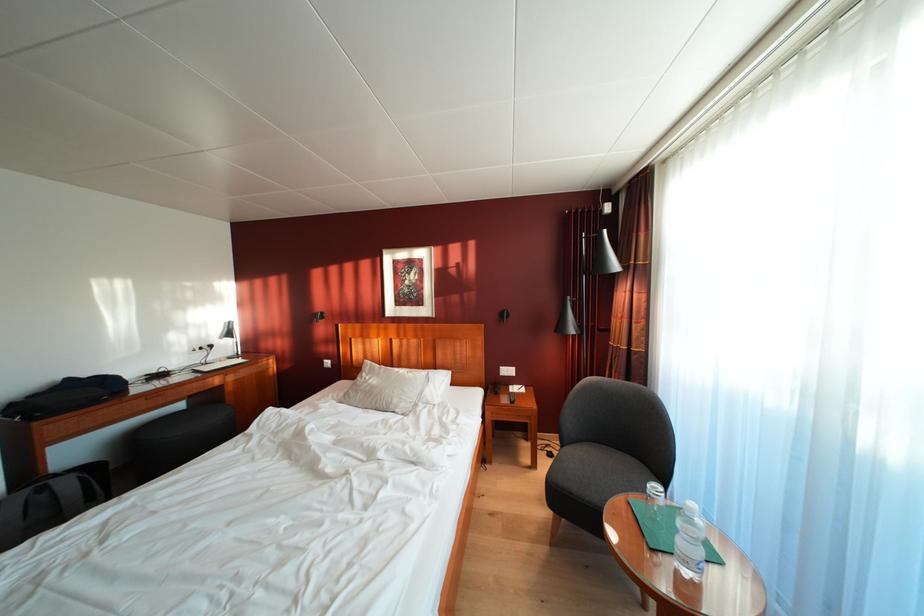
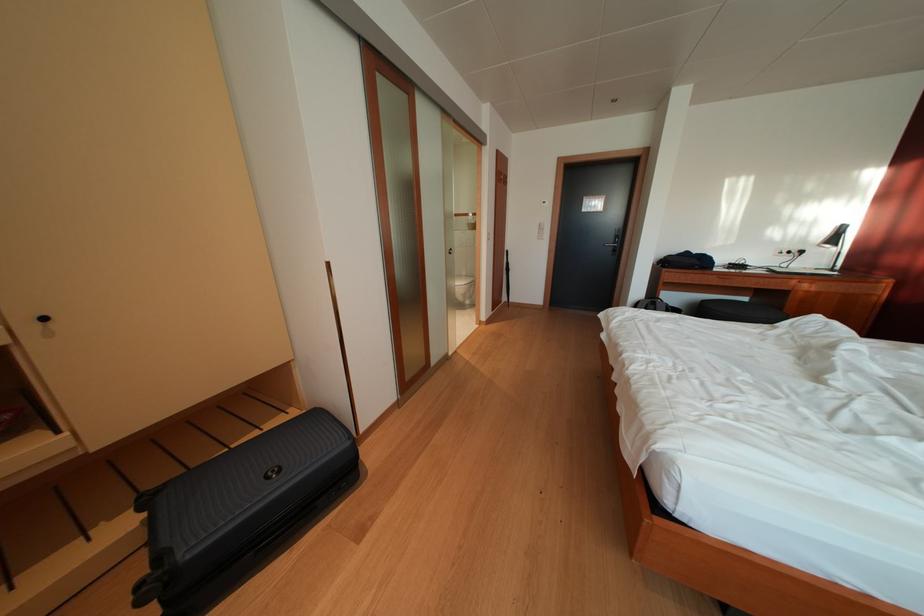
Where in the second image is the point corresponding to (x=237, y=339) from the first image?

(842, 246)